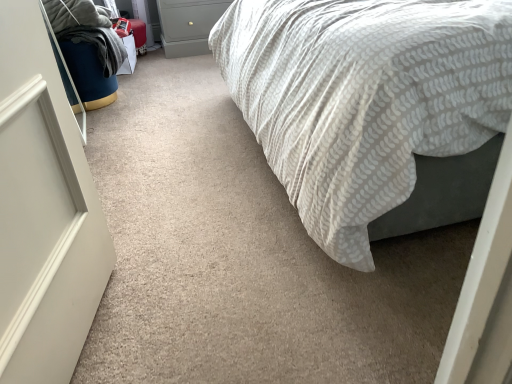
What are the coordinates of `matte gray drawer at upper center` in the screenshot? It's located at (189, 18).

In order to face matte gray drawer at upper center, should I rotate leftwards or rightwards?

Rotate your view left by about 7.641°.

The image size is (512, 384). What do you see at coordinates (87, 49) in the screenshot?
I see `velvet blue bean bag at left` at bounding box center [87, 49].

Image resolution: width=512 pixels, height=384 pixels. In order to click on matte gray drawer at upper center in this screenshot , I will do `click(189, 18)`.

Which is more to the right, velvet blue bean bag at left or matte gray drawer at upper center?

matte gray drawer at upper center is more to the right.

From their relative heights in the image, would you say velvet blue bean bag at left is taller or shorter than matte gray drawer at upper center?

In the image, velvet blue bean bag at left appears to be shorter than matte gray drawer at upper center.

Which point is more forward, (66, 1) or (205, 10)?

Positioned in front is point (66, 1).

Who is shorter, white textured fabric bed at center or velvet blue bean bag at left?

With less height is velvet blue bean bag at left.

Where is `bed located on the right of velvet blue bean bag at left`? This screenshot has width=512, height=384. bed located on the right of velvet blue bean bag at left is located at coordinates (362, 98).

Which of these two, white textured fabric bed at center or velvet blue bean bag at left, is wider?

Wider between the two is white textured fabric bed at center.

From the image's perspective, would you say white textured fabric bed at center is positioned over velvet blue bean bag at left?

No.

Who is bigger, matte gray drawer at upper center or white textured fabric bed at center?

white textured fabric bed at center.

Could you tell me if matte gray drawer at upper center is facing white textured fabric bed at center?

Yes, matte gray drawer at upper center is turned towards white textured fabric bed at center.

Consider the image. Based on their positions, is matte gray drawer at upper center located to the left or right of white textured fabric bed at center?

From the image, it's evident that matte gray drawer at upper center is to the left of white textured fabric bed at center.

Between velvet blue bean bag at left and white textured fabric bed at center, which one has smaller width?

velvet blue bean bag at left is thinner.

Is white textured fabric bed at center inside velvet blue bean bag at left?

That's incorrect, white textured fabric bed at center is not inside velvet blue bean bag at left.

Would you consider velvet blue bean bag at left to be distant from white textured fabric bed at center?

velvet blue bean bag at left is far away from white textured fabric bed at center.

Considering the sizes of objects velvet blue bean bag at left and white textured fabric bed at center in the image provided, who is taller, velvet blue bean bag at left or white textured fabric bed at center?

With more height is white textured fabric bed at center.

Is point (230, 21) positioned after point (158, 10)?

That is False.

Is white textured fabric bed at center oriented towards matte gray drawer at upper center?

No, white textured fabric bed at center is not aimed at matte gray drawer at upper center.

Which is behind, white textured fabric bed at center or matte gray drawer at upper center?

matte gray drawer at upper center.

Which object is positioned more to the left, white textured fabric bed at center or matte gray drawer at upper center?

matte gray drawer at upper center.

Which object is thinner, matte gray drawer at upper center or velvet blue bean bag at left?

velvet blue bean bag at left is thinner.

Considering the relative positions of matte gray drawer at upper center and velvet blue bean bag at left in the image provided, is matte gray drawer at upper center behind velvet blue bean bag at left?

Yes, it is behind velvet blue bean bag at left.

From a real-world perspective, which is physically below, matte gray drawer at upper center or velvet blue bean bag at left?

In real-world perspective, velvet blue bean bag at left is lower.

Are matte gray drawer at upper center and velvet blue bean bag at left located far from each other?

matte gray drawer at upper center is actually quite close to velvet blue bean bag at left.

There is a velvet blue bean bag at left. Where is `drawer above it (from a real-world perspective)`? This screenshot has height=384, width=512. drawer above it (from a real-world perspective) is located at coordinates (189, 18).

Where is `bed on the right of velvet blue bean bag at left`? This screenshot has width=512, height=384. bed on the right of velvet blue bean bag at left is located at coordinates (362, 98).

Looking at the image, which one is located further to matte gray drawer at upper center, white textured fabric bed at center or velvet blue bean bag at left?

white textured fabric bed at center lies further to matte gray drawer at upper center than the other object.

Looking at the image, which one is located further to matte gray drawer at upper center, velvet blue bean bag at left or white textured fabric bed at center?

white textured fabric bed at center.

Which object lies nearer to the anchor point white textured fabric bed at center, matte gray drawer at upper center or velvet blue bean bag at left?

velvet blue bean bag at left lies closer to white textured fabric bed at center than the other object.

Looking at this image, considering their positions, is white textured fabric bed at center positioned further to velvet blue bean bag at left than matte gray drawer at upper center?

Based on the image, white textured fabric bed at center appears to be further to velvet blue bean bag at left.

Looking at the image, which one is located further to white textured fabric bed at center, velvet blue bean bag at left or matte gray drawer at upper center?

Based on the image, matte gray drawer at upper center appears to be further to white textured fabric bed at center.

Estimate the real-world distances between objects in this image. Which object is further from velvet blue bean bag at left, matte gray drawer at upper center or white textured fabric bed at center?

Based on the image, white textured fabric bed at center appears to be further to velvet blue bean bag at left.

Locate an element on the screen. Image resolution: width=512 pixels, height=384 pixels. bean bag chair located between white textured fabric bed at center and matte gray drawer at upper center in the depth direction is located at coordinates click(x=87, y=49).